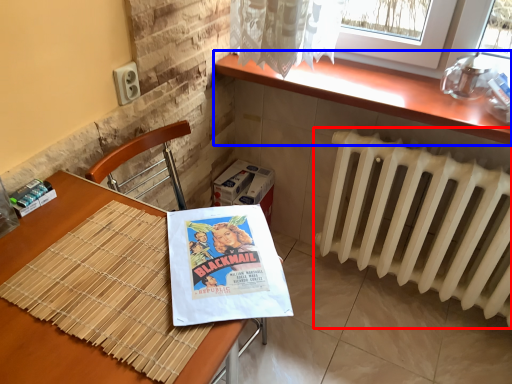
Question: Which object appears closest to the camera in this image, radiator (highlighted by a red box) or counter top (highlighted by a blue box)?

Choices:
 (A) radiator
 (B) counter top

Answer: (A)